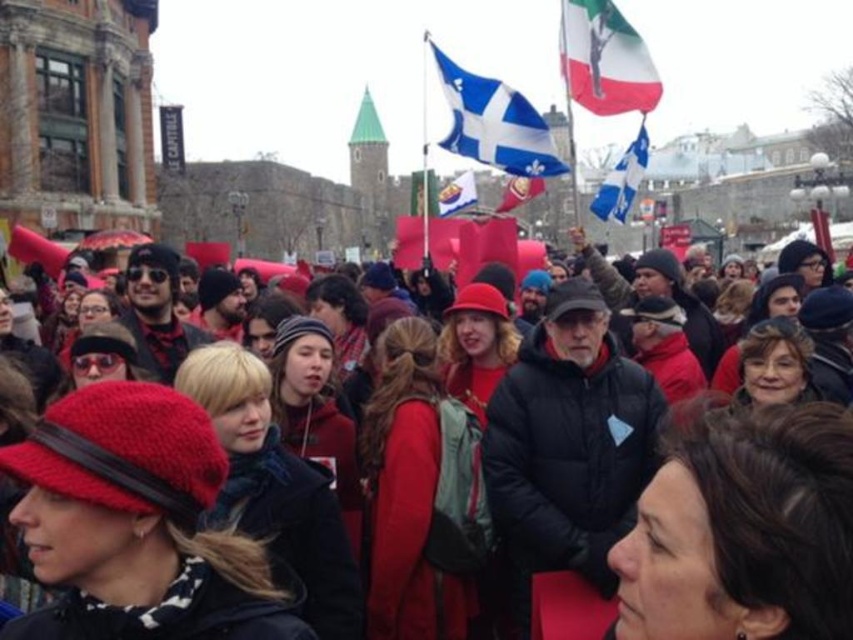
You are a photographer standing at the center of the crowd at the protest. You want to take a photo that includes both the point at coordinates point (643, 577) and point (566, 1). Which point should you position closer to the camera to ensure both are in focus?

You should position the point at coordinates point (643, 577) closer to the camera because it is already closer to the viewer than point (566, 1), ensuring both points are within the depth of field.

You are a photographer standing at the front of the protest. You want to capture a clear shot of the white fabric flag at upper right. Considering your current position, is the flag within a 100 meter range for your telephoto lens to focus properly?

The white fabric flag at upper right is 74.09 meters away from viewer. Since 74.09 meters is within the 100 meter range, the telephoto lens can focus properly on the flag.

You are a photographer standing at the edge of the protest crowd. You want to take a photo that includes both the red knit hat at center and the white fabric flag at upper right. Given that your camera has a maximum zoom range of 30 meters, will you be able to capture both objects in a single frame without moving closer?

The red knit hat at center and white fabric flag at upper right are 35.31 meters apart. Since your camera can only zoom up to 30 meters, you won cannot capture both in a single frame without moving closer.